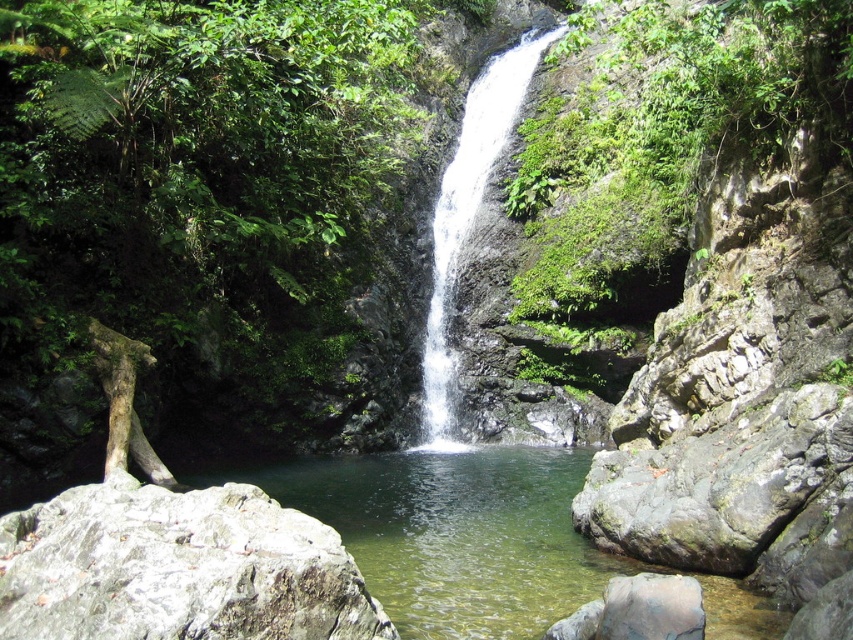
You are a hiker who wants to cross the pool at the base of the waterfall. The clear water at center is where you plan to step. If your hiking boots have a 10 meter rope attached, can you safely reach the other side of the pool without getting your boots wet?

The clear water at center is 9.76 meters wide. Since the rope is 10 meters long, it is long enough to safely reach the other side without getting the boots wet.

You are a hiker who wants to cross the pool at the center of the image to reach the other side. Given that the clear water at center is larger than the gray rough rock at lower left, which area would provide a safer path for walking?

The clear water at center has a larger size compared to the gray rough rock at lower left, so the clear water at center offers a safer path for walking because its larger surface area provides more stable footing than the smaller gray rough rock at lower left.